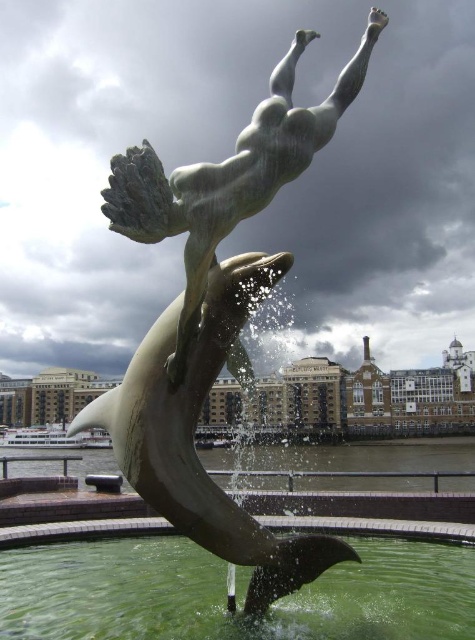
You are a tourist standing in front of the sculpture at BUTLERS WHARF. You want to take a photo of both the shiny silver dolphin at center and the bronze statue at center. Which object should you focus on first to ensure both are in frame?

You should focus on the bronze statue at center first because the shiny silver dolphin at center is closer to the viewer, so adjusting the focus starting from the farther object ensures both are in frame.

You are a photographer standing at the waterfront. You want to capture a photo where the green liquid water at center is clearly visible in front of the bronze statue at center. Is this possible based on the scene description?

Yes, the green liquid water at center is in front of the bronze statue at center, so it will be visible in the photo as it is positioned in front.